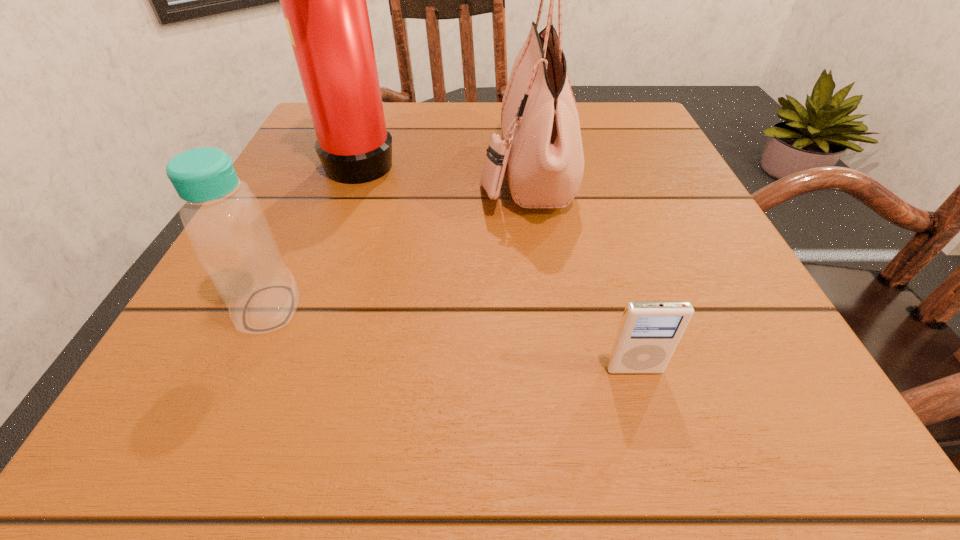
Locate an element on the screen. The height and width of the screenshot is (540, 960). free space at the right edge of the desktop is located at coordinates 711,222.

What are the coordinates of `vacant space at the near left corner` in the screenshot? It's located at (207, 383).

I want to click on free space at the far right corner, so click(x=660, y=142).

This screenshot has width=960, height=540. I want to click on free region at the near right corner of the desktop, so click(x=677, y=381).

The image size is (960, 540). I want to click on vacant space that is in between the fire extinguisher and the handbag, so click(x=444, y=165).

The image size is (960, 540). In order to click on empty location between the second tallest object and the nearest object in this screenshot , I will do `click(580, 270)`.

I want to click on unoccupied position between the second tallest object and the fire extinguisher, so click(444, 165).

Locate an element on the screen. This screenshot has height=540, width=960. free area in between the handbag and the nearest object is located at coordinates (580, 270).

The image size is (960, 540). I want to click on free space between the fire extinguisher and the third shortest object, so click(444, 165).

Where is `free point between the bottle and the shortest object`? This screenshot has height=540, width=960. free point between the bottle and the shortest object is located at coordinates (451, 339).